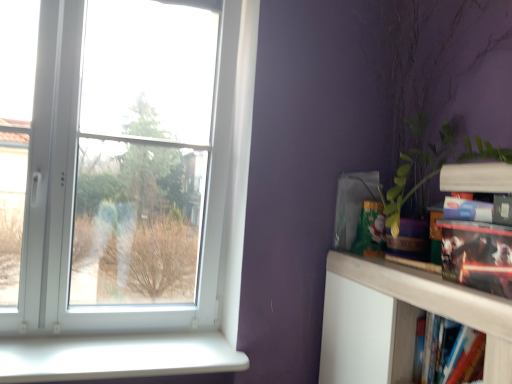
Question: Considering the positions of white plastic window sill at lower left and green leafy plant at right in the image, is white plastic window sill at lower left taller or shorter than green leafy plant at right?

Choices:
 (A) short
 (B) tall

Answer: (A)

Question: Relative to green leafy plant at right, is white plastic window sill at lower left in front or behind?

Choices:
 (A) behind
 (B) front

Answer: (A)

Question: Which is farther from the hardcover book at lower right, the 2th book when ordered from top to bottom?

Choices:
 (A) matt black book at right, positioned as the 1th book in top-to-bottom order
 (B) white plastic window sill at lower left
 (C) green leafy plant at right
 (D) white plastic window at upper left
 (E) white matte shelf at upper right

Answer: (D)

Question: Which of these objects is positioned farthest from the white plastic window at upper left?

Choices:
 (A) green leafy plant at right
 (B) white plastic window sill at lower left
 (C) hardcover book at lower right, the 2th book when ordered from top to bottom
 (D) matt black book at right, positioned as the 1th book in top-to-bottom order
 (E) white matte shelf at upper right

Answer: (D)